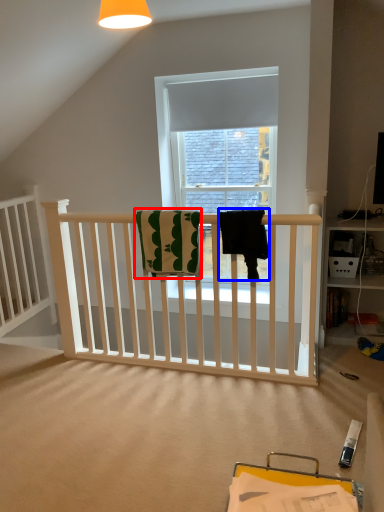
Question: Which object appears closest to the camera in this image, beach towel (highlighted by a red box) or beach towel (highlighted by a blue box)?

Choices:
 (A) beach towel
 (B) beach towel

Answer: (B)